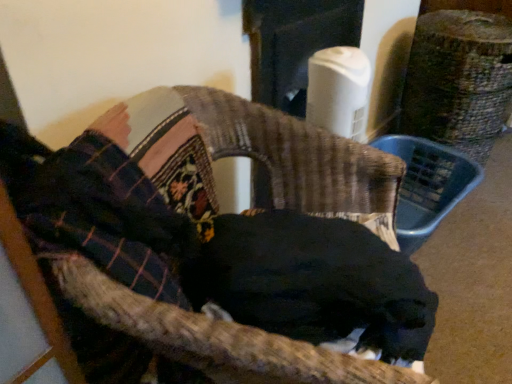
Question: Is woven fabric chair at center further to camera compared to black fur dog at center?

Choices:
 (A) yes
 (B) no

Answer: (B)

Question: Is woven fabric chair at center positioned beyond the bounds of black fur dog at center?

Choices:
 (A) yes
 (B) no

Answer: (A)

Question: Does woven fabric chair at center have a greater width compared to black fur dog at center?

Choices:
 (A) no
 (B) yes

Answer: (B)

Question: From a real-world perspective, is woven fabric chair at center below black fur dog at center?

Choices:
 (A) yes
 (B) no

Answer: (A)

Question: Can you confirm if woven fabric chair at center is taller than black fur dog at center?

Choices:
 (A) no
 (B) yes

Answer: (B)

Question: In terms of width, does black fur dog at center look wider or thinner when compared to woven fabric chair at center?

Choices:
 (A) wide
 (B) thin

Answer: (B)

Question: Based on their positions, is black fur dog at center located to the left or right of woven fabric chair at center?

Choices:
 (A) right
 (B) left

Answer: (A)

Question: Considering the positions of point (289, 296) and point (189, 253), is point (289, 296) closer or farther from the camera than point (189, 253)?

Choices:
 (A) closer
 (B) farther

Answer: (A)

Question: From a real-world perspective, relative to woven fabric chair at center, is black fur dog at center vertically above or below?

Choices:
 (A) below
 (B) above

Answer: (B)

Question: From the image's perspective, is plaid fabric at upper left positioned above or below black fur dog at center?

Choices:
 (A) above
 (B) below

Answer: (A)

Question: Is plaid fabric at upper left in front of or behind black fur dog at center in the image?

Choices:
 (A) behind
 (B) front

Answer: (B)

Question: From a real-world perspective, is plaid fabric at upper left above or below black fur dog at center?

Choices:
 (A) below
 (B) above

Answer: (B)

Question: Would you say plaid fabric at upper left is to the left or to the right of black fur dog at center in the picture?

Choices:
 (A) left
 (B) right

Answer: (A)

Question: Relative to plaid fabric at upper left, is woven fabric chair at center in front or behind?

Choices:
 (A) front
 (B) behind

Answer: (A)

Question: From the image's perspective, is woven fabric chair at center above or below plaid fabric at upper left?

Choices:
 (A) below
 (B) above

Answer: (A)